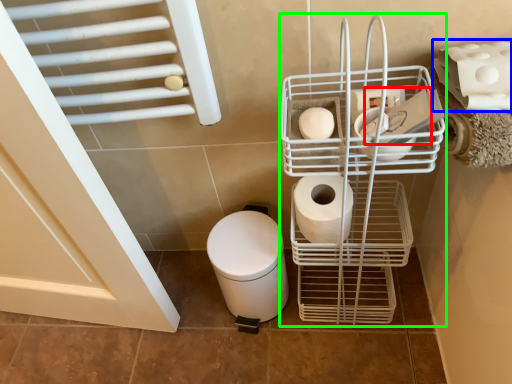
Question: Which object is positioned farthest from toilet paper (highlighted by a red box)? Select from toilet paper (highlighted by a blue box) and shopping cart (highlighted by a green box).

Choices:
 (A) toilet paper
 (B) shopping cart

Answer: (B)